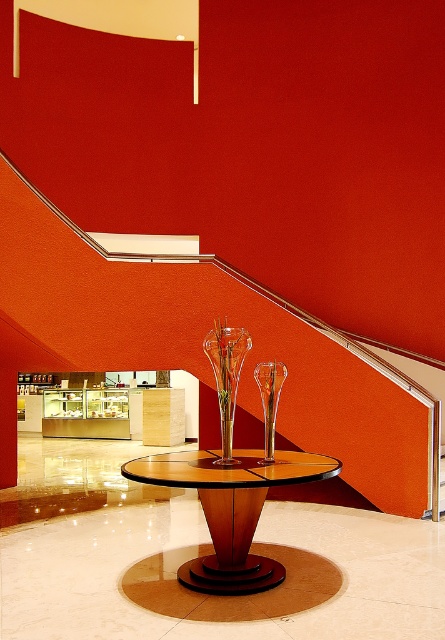
Can you confirm if transparent glass vase at center is positioned below clear glass vase at center?

No, transparent glass vase at center is not below clear glass vase at center.

Can you confirm if transparent glass vase at center is wider than clear glass vase at center?

Yes.

In order to click on transparent glass vase at center in this screenshot , I will do `click(226, 378)`.

This screenshot has height=640, width=445. Describe the element at coordinates (112, 410) in the screenshot. I see `matte glass display case at center` at that location.

Which is below, matte glass display case at center or transparent glass vase at center?

matte glass display case at center

Who is more distant from viewer, (53, 428) or (233, 376)?

Point (53, 428)

This screenshot has width=445, height=640. In order to click on matte glass display case at center in this screenshot , I will do tap(112, 410).

Consider the image. Who is more forward, [177,577] or [237,372]?

Point [237,372]

The height and width of the screenshot is (640, 445). What do you see at coordinates (230, 509) in the screenshot?
I see `wooden polished table at center` at bounding box center [230, 509].

Where is `wooden polished table at center`? Image resolution: width=445 pixels, height=640 pixels. wooden polished table at center is located at coordinates (230, 509).